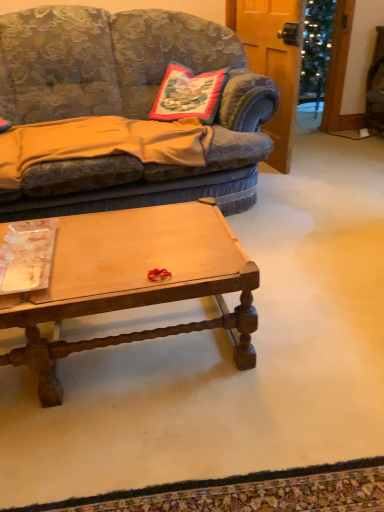
Find the location of a particular element. This screenshot has width=384, height=512. free space on the front side of light brown wood coffee table at center is located at coordinates (125, 441).